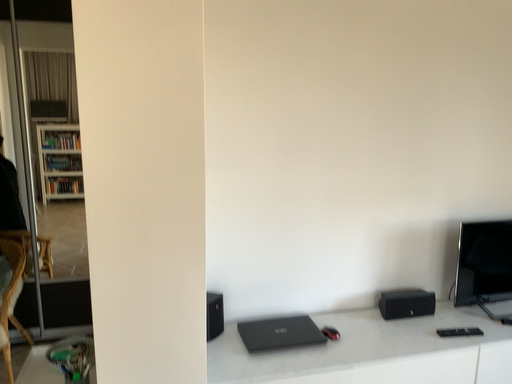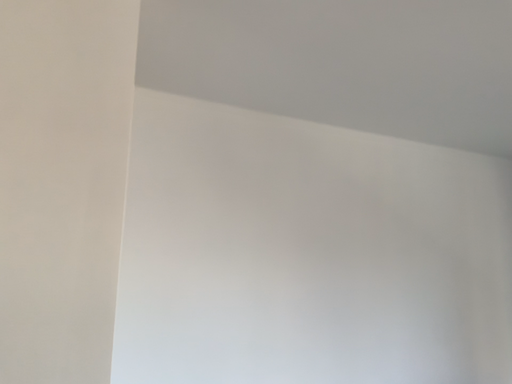
Question: How did the camera likely rotate when shooting the video?

Choices:
 (A) rotated upward
 (B) rotated downward

Answer: (A)